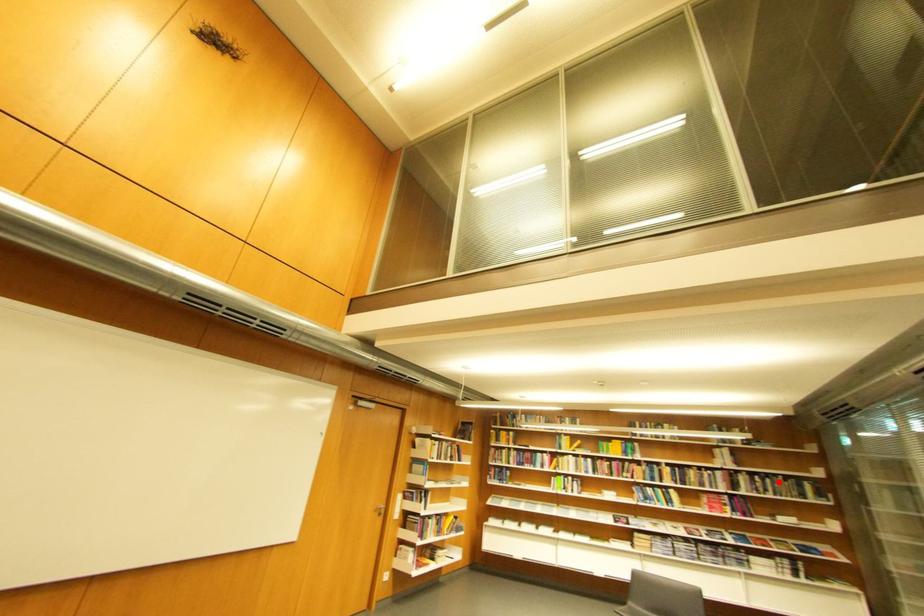
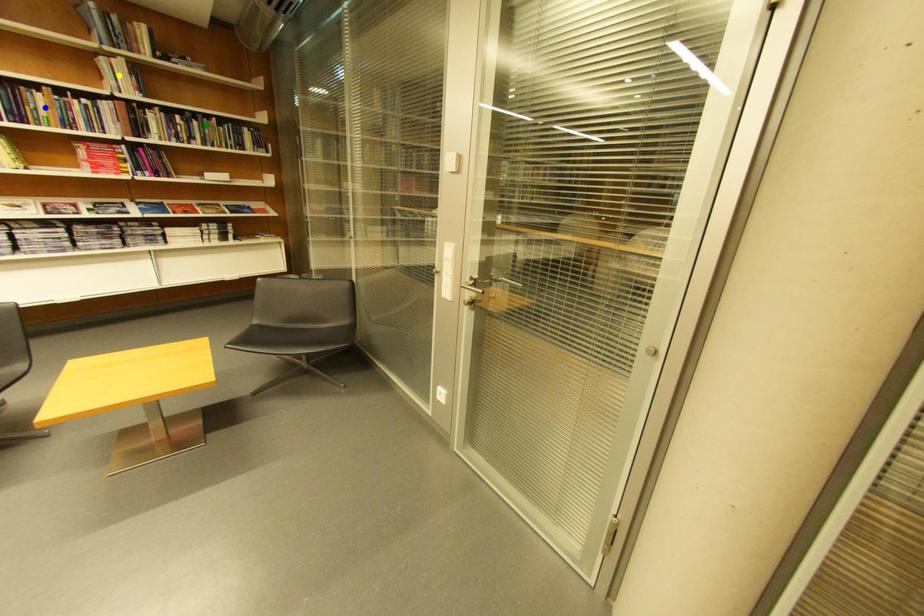
Question: I am providing you with two images of the same scene from different viewpoints. A red point is marked on the first image. You are given multiple points on the second image. Which point in image 2 is actually the same real-world point as the red point in image 1?

Choices:
 (A) blue point
 (B) yellow point
 (C) green point

Answer: (C)